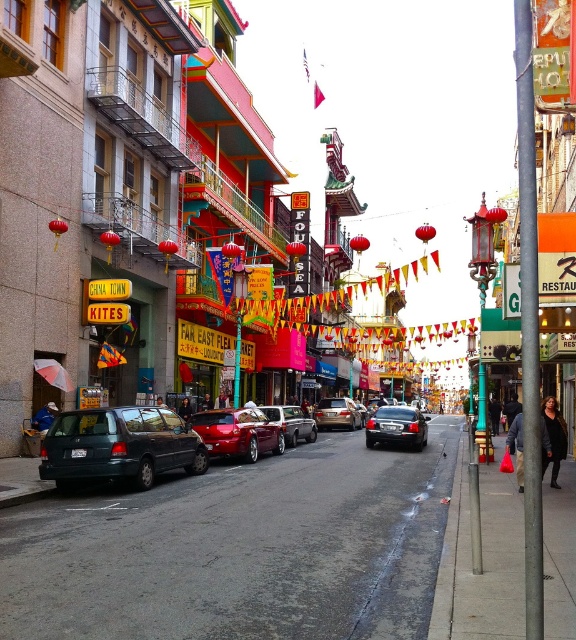
Between teal matte station wagon at lower left and shiny red car at center, which one has less height?

With less height is teal matte station wagon at lower left.

Which is above, teal matte station wagon at lower left or shiny red car at center?

teal matte station wagon at lower left is above.

Which is behind, point (115, 419) or point (293, 438)?

The point (293, 438) is more distant.

Image resolution: width=576 pixels, height=640 pixels. Identify the location of teal matte station wagon at lower left. (119, 445).

Can you confirm if dark asphalt road at center is positioned below glossy red car at center?

Indeed, dark asphalt road at center is positioned under glossy red car at center.

This screenshot has width=576, height=640. Identify the location of dark asphalt road at center. (240, 548).

The image size is (576, 640). I want to click on dark asphalt road at center, so click(240, 548).

Does dark asphalt road at center lie in front of black leather jacket at right?

No, dark asphalt road at center is further to the viewer.

Does dark asphalt road at center have a lesser width compared to black leather jacket at right?

In fact, dark asphalt road at center might be wider than black leather jacket at right.

Image resolution: width=576 pixels, height=640 pixels. Describe the element at coordinates (240, 548) in the screenshot. I see `dark asphalt road at center` at that location.

Where is `dark asphalt road at center`? This screenshot has width=576, height=640. dark asphalt road at center is located at coordinates (240, 548).